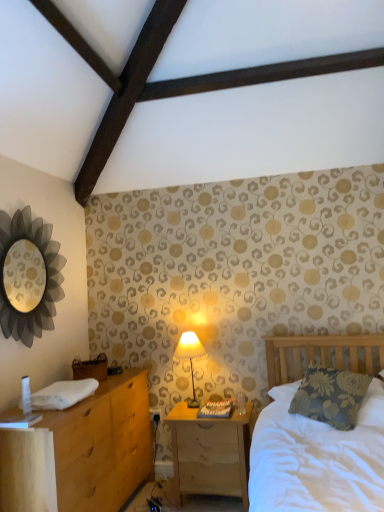
Question: Is metallic silver mirror at upper left completely or partially outside of matte cream fabric lampshade at center?

Choices:
 (A) yes
 (B) no

Answer: (A)

Question: Is metallic silver mirror at upper left not near matte cream fabric lampshade at center?

Choices:
 (A) yes
 (B) no

Answer: (A)

Question: Can you confirm if metallic silver mirror at upper left is wider than matte cream fabric lampshade at center?

Choices:
 (A) yes
 (B) no

Answer: (B)

Question: From the image's perspective, is metallic silver mirror at upper left over matte cream fabric lampshade at center?

Choices:
 (A) no
 (B) yes

Answer: (B)

Question: Is metallic silver mirror at upper left to the right of matte cream fabric lampshade at center from the viewer's perspective?

Choices:
 (A) yes
 (B) no

Answer: (B)

Question: In the image, is light brown wood chest of drawers at left on the left side or the right side of wooden nightstand at lower center?

Choices:
 (A) left
 (B) right

Answer: (A)

Question: Looking at their shapes, would you say light brown wood chest of drawers at left is wider or thinner than wooden nightstand at lower center?

Choices:
 (A) thin
 (B) wide

Answer: (B)

Question: Would you say light brown wood chest of drawers at left is inside or outside wooden nightstand at lower center?

Choices:
 (A) outside
 (B) inside

Answer: (A)

Question: Is light brown wood chest of drawers at left in front of or behind wooden nightstand at lower center in the image?

Choices:
 (A) behind
 (B) front

Answer: (B)

Question: In the image, is matte cream fabric lampshade at center on the left side or the right side of floral fabric pillow at right?

Choices:
 (A) right
 (B) left

Answer: (B)

Question: In terms of size, does matte cream fabric lampshade at center appear bigger or smaller than floral fabric pillow at right?

Choices:
 (A) big
 (B) small

Answer: (B)

Question: From the image's perspective, relative to floral fabric pillow at right, is matte cream fabric lampshade at center above or below?

Choices:
 (A) below
 (B) above

Answer: (B)

Question: Is matte cream fabric lampshade at center in front of or behind floral fabric pillow at right in the image?

Choices:
 (A) behind
 (B) front

Answer: (A)

Question: Would you say wooden nightstand at lower center is to the left or to the right of metallic silver mirror at upper left in the picture?

Choices:
 (A) left
 (B) right

Answer: (B)

Question: From a real-world perspective, is wooden nightstand at lower center positioned above or below metallic silver mirror at upper left?

Choices:
 (A) below
 (B) above

Answer: (A)